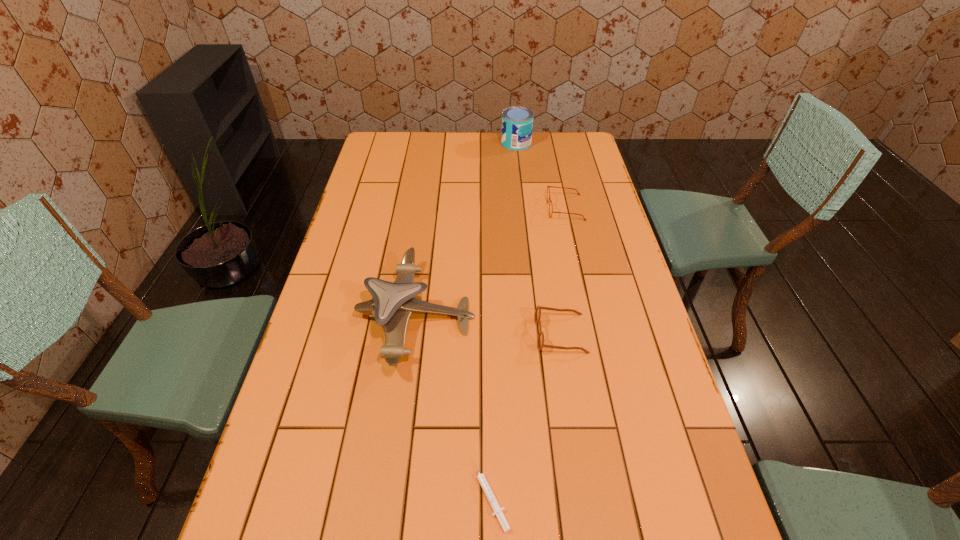
The height and width of the screenshot is (540, 960). I want to click on free region at the left edge of the desktop, so click(x=286, y=537).

Locate an element on the screen. Image resolution: width=960 pixels, height=540 pixels. free space at the right edge of the desktop is located at coordinates (579, 239).

Locate an element on the screen. The height and width of the screenshot is (540, 960). free space between the fourth nearest object and the second tallest object is located at coordinates (491, 262).

Identify the location of vacant space in between the farthest object and the nearer spectacles. The image size is (960, 540). (539, 239).

Find the location of a particular element. The image size is (960, 540). free spot between the second farthest object and the nearer spectacles is located at coordinates (564, 271).

The width and height of the screenshot is (960, 540). What are the coordinates of `free space that is in between the fourth shortest object and the shortest object` in the screenshot? It's located at (453, 406).

Locate an element on the screen. The image size is (960, 540). vacant point located between the second farthest object and the nearest object is located at coordinates (528, 351).

The height and width of the screenshot is (540, 960). Identify the location of vacant space that is in between the nearer spectacles and the drone. (489, 325).

The height and width of the screenshot is (540, 960). Identify the location of free area in between the nearest object and the nearer spectacles. (525, 414).

At what (x,y) coordinates should I click in order to perform the action: click on free space between the farthest object and the farther spectacles. Please return your answer as a coordinate pair (x, y). Looking at the image, I should click on (540, 176).